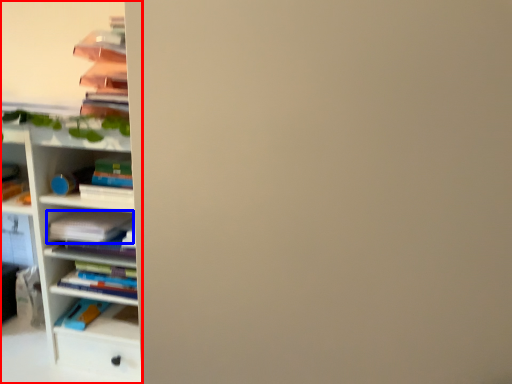
Question: Which object is closer to the camera taking this photo, shelf (highlighted by a red box) or book (highlighted by a blue box)?

Choices:
 (A) shelf
 (B) book

Answer: (A)